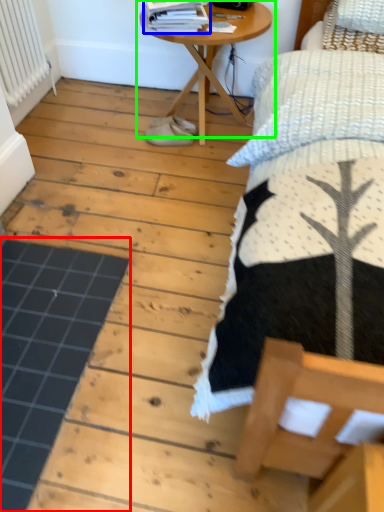
Question: Based on their relative distances, which object is nearer to plank (highlighted by a red box)? Choose from magazine (highlighted by a blue box) and table (highlighted by a green box).

Choices:
 (A) magazine
 (B) table

Answer: (B)